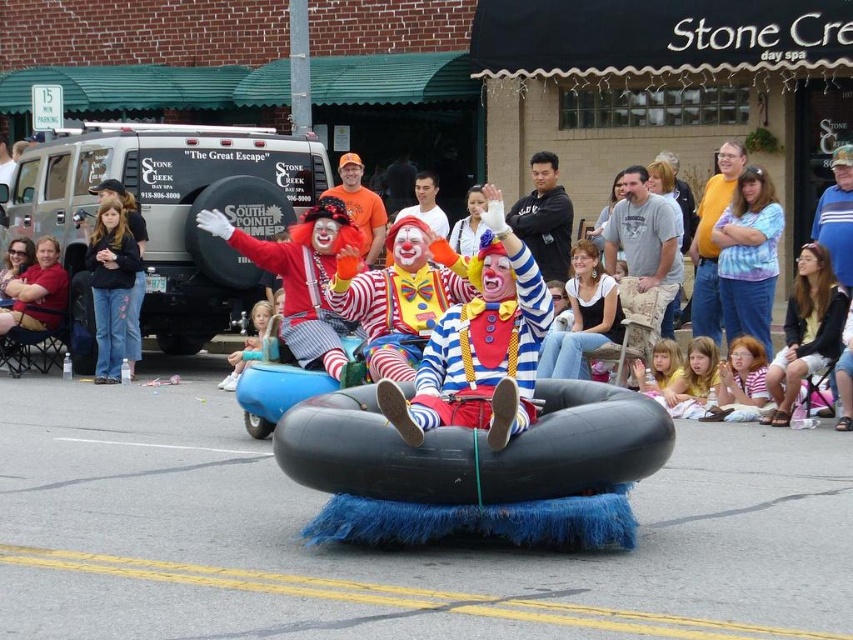
Question: Is black cotton shirt at center bigger than matte brown leather jacket at left?

Choices:
 (A) no
 (B) yes

Answer: (B)

Question: Is matte clown costume at center thinner than black cotton shirt at center?

Choices:
 (A) no
 (B) yes

Answer: (A)

Question: Estimate the real-world distances between objects in this image. Which object is farther from the black cotton shirt at center?

Choices:
 (A) matte clown costume at center
 (B) matte brown leather jacket at left

Answer: (A)

Question: Which of the following is the farthest from the observer?

Choices:
 (A) matte clown costume at center
 (B) black cotton shirt at center

Answer: (B)

Question: Is matte brown leather jacket at left smaller than orange cotton t-shirt at center?

Choices:
 (A) yes
 (B) no

Answer: (A)

Question: Which object is positioned farthest from the matte brown leather jacket at left?

Choices:
 (A) black cotton shirt at center
 (B) orange cotton t-shirt at center

Answer: (A)